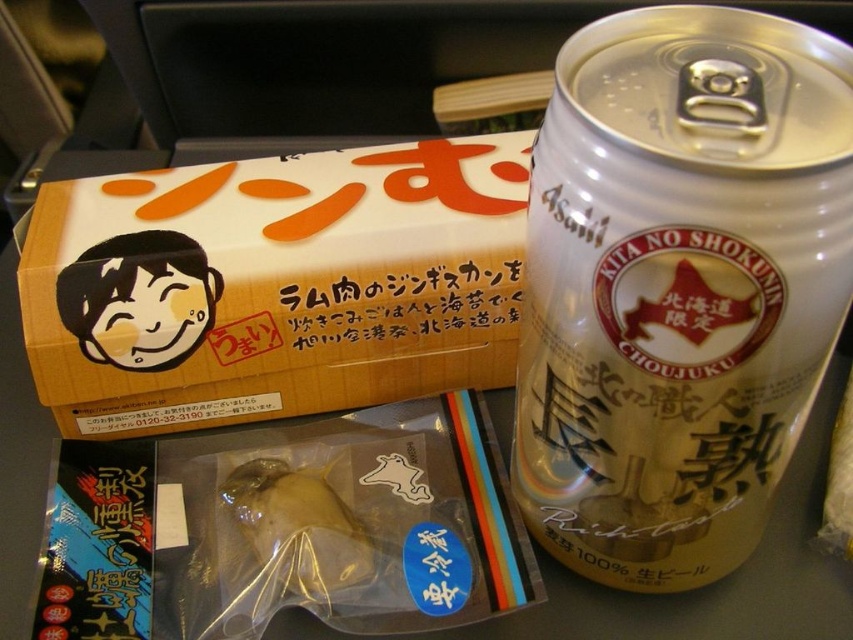
Question: Is gold metallic can at right to the left of wooden-textured box at upper left from the viewer's perspective?

Choices:
 (A) yes
 (B) no

Answer: (B)

Question: Which object is the farthest from the translucent plastic fish at center?

Choices:
 (A) gold metallic can at right
 (B) wooden-textured box at upper left

Answer: (A)

Question: Based on their relative distances, which object is nearer to the gold metallic can at right?

Choices:
 (A) wooden-textured box at upper left
 (B) translucent plastic fish at center

Answer: (A)

Question: Is gold metallic can at right behind wooden-textured box at upper left?

Choices:
 (A) no
 (B) yes

Answer: (A)

Question: Is gold metallic can at right wider than translucent plastic fish at center?

Choices:
 (A) no
 (B) yes

Answer: (B)

Question: Which point appears farthest from the camera in this image?

Choices:
 (A) (352, 193)
 (B) (270, 531)
 (C) (682, 97)

Answer: (A)